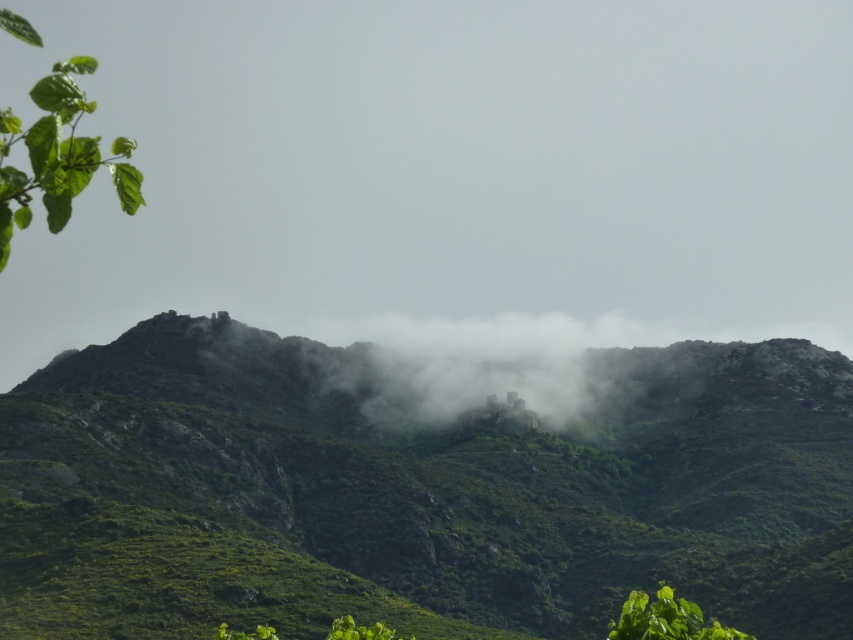
You are an explorer in this misty mountain landscape. You see the foggy misty castle at center and the green leafy branch at upper left. Which object is positioned to the right of the other?

The foggy misty castle at center is to the right of the green leafy branch at upper left.

You are an architect designing a new garden. You want to place a statue that is 2 meters wide between the foggy misty castle at center and the green leafy branch at upper left. Can you fit it there based on their widths?

The foggy misty castle at center is narrower than the green leafy branch at upper left. Since the statue is 2 meters wide, it can be placed between them as long as the space between them is at least 2 meters. However, the exact width of the space isn

You are a hiker who wants to take a photo of the foggy misty castle at center and the green leafy plant at lower right together in the same frame. Given that your camera has a maximum zoom range of 100 feet, can you capture both objects in one shot without moving your position?

The foggy misty castle at center and green leafy plant at lower right are 464.40 feet apart. Since your camera can only zoom up to 100 feet, you cannot capture both objects in one shot without moving your position because the distance between them exceeds the camera zoom range.